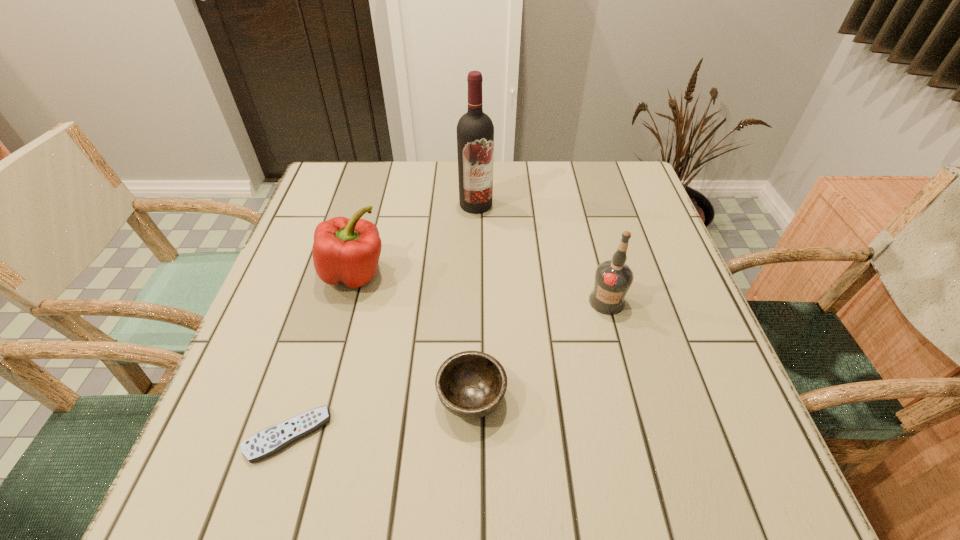
Locate an element on the screen. free area in between the bowl and the shortest object is located at coordinates (x=379, y=416).

Identify the location of vacant space that's between the bell pepper and the rightmost object. (481, 287).

The width and height of the screenshot is (960, 540). I want to click on free spot between the vodka and the second shortest object, so click(540, 349).

The width and height of the screenshot is (960, 540). What are the coordinates of `empty location between the wine bottle and the second tallest object` in the screenshot? It's located at pyautogui.click(x=541, y=253).

Where is `object that is the second nearest to the tallest object`? The image size is (960, 540). object that is the second nearest to the tallest object is located at coordinates (613, 278).

Find the location of a particular element. object that is the fourth closest to the remote control is located at coordinates (475, 131).